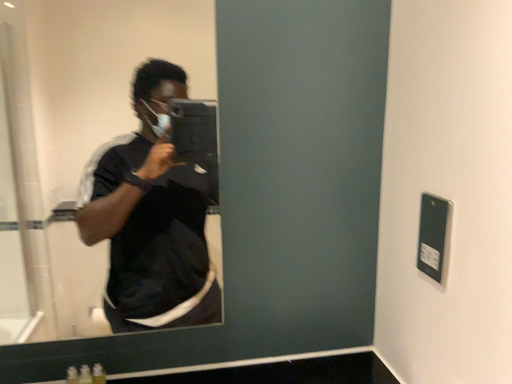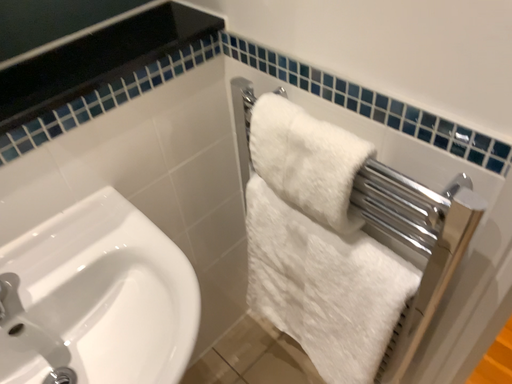
Question: How did the camera likely rotate when shooting the video?

Choices:
 (A) rotated downward
 (B) rotated upward

Answer: (A)